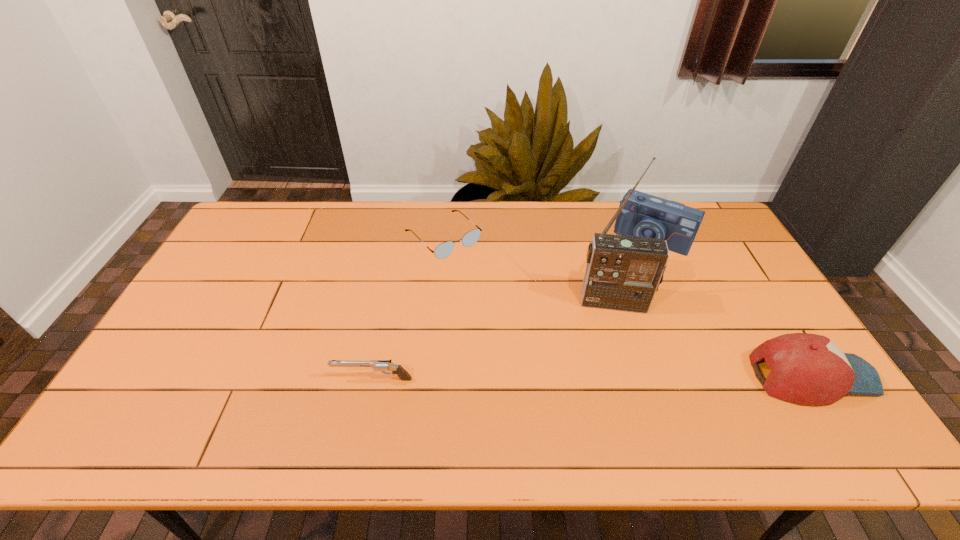
The height and width of the screenshot is (540, 960). Identify the location of pistol. (378, 365).

Image resolution: width=960 pixels, height=540 pixels. Find the location of `baseball cap`. baseball cap is located at coordinates (807, 369).

Image resolution: width=960 pixels, height=540 pixels. In order to click on the shortest object in this screenshot , I will do `click(443, 250)`.

You are a GUI agent. You are given a task and a screenshot of the screen. Output one action in this format:
    pyautogui.click(x=<x>, y=<y>)
    Task: Click on the third farthest object
    The width and height of the screenshot is (960, 540).
    Given the screenshot: What is the action you would take?
    pyautogui.click(x=623, y=273)

At what (x,y) coordinates should I click in order to perform the action: click on radio receiver. Please return your answer as a coordinate pair (x, y). Image resolution: width=960 pixels, height=540 pixels. Looking at the image, I should click on (623, 273).

Where is `the second tallest object`? Image resolution: width=960 pixels, height=540 pixels. the second tallest object is located at coordinates (644, 215).

In order to click on vacant space located on the front-facing side of the second shortest object in this screenshot , I will do `click(276, 379)`.

The width and height of the screenshot is (960, 540). In order to click on free spot located on the front-facing side of the second shortest object in this screenshot , I will do `click(209, 379)`.

The height and width of the screenshot is (540, 960). What are the coordinates of `vacant space located 0.360m on the front-facing side of the second shortest object` in the screenshot? It's located at (193, 379).

Locate an element on the screen. vacant space situated on the lenses of the shortest object is located at coordinates (515, 305).